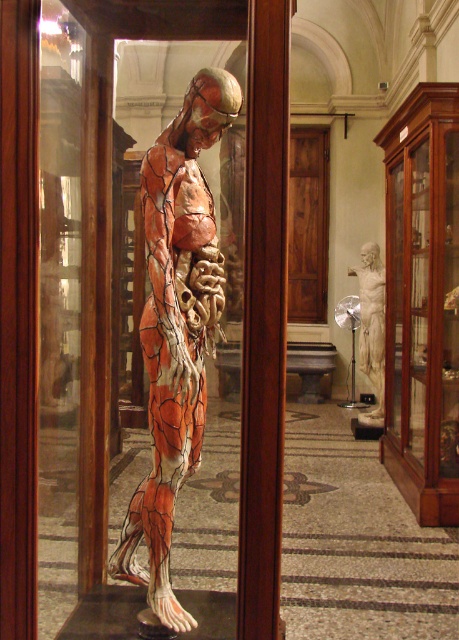
You are standing in front of the anatomical exhibit and want to touch the point at coordinates (174, 268). The glass case is 6 feet tall. Can you reach the point without a ladder?

The point at coordinates (174, 268) is 6.74 feet from the viewer, which is taller than the 6 feet glass case. Therefore, you cannot reach it without a ladder.

You are a visitor at the museum and want to take a photo of the transparent glass at center and the white marble statue at center. Which object is wider so that it can be captured in full frame without cropping?

The transparent glass at center is wider than the white marble statue at center, so capturing the transparent glass at center in full frame without cropping is possible.